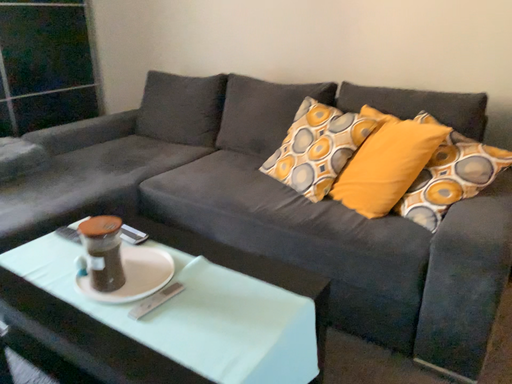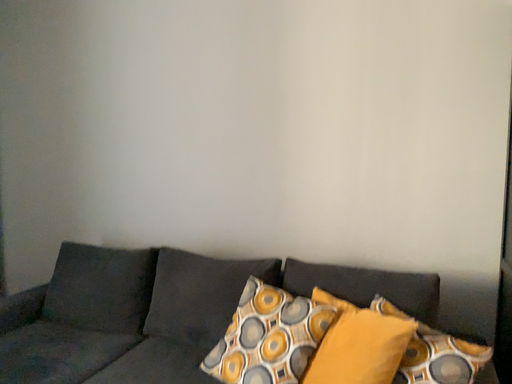
Question: How did the camera likely rotate when shooting the video?

Choices:
 (A) rotated downward
 (B) rotated upward

Answer: (B)